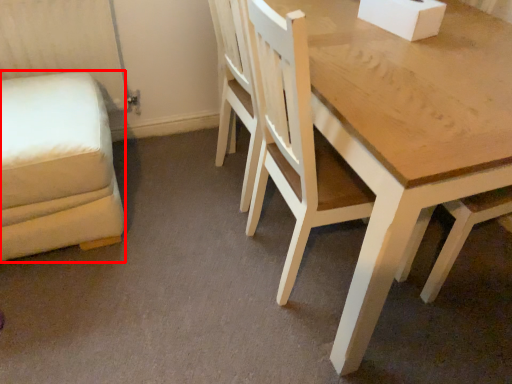
Question: From the image's perspective, where is swivel chair (annotated by the red box) located in relation to chair in the image?

Choices:
 (A) below
 (B) above

Answer: (A)